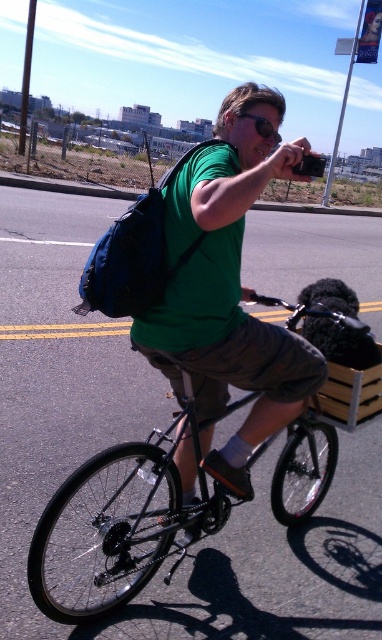
You are a photographer standing at the scene. You need to capture a photo where the green matte shirt at center and the black matte bicycle at center are both clearly visible. Based on their sizes in the image, which object should you focus on first to ensure both are in frame?

The green matte shirt at center is taller than the black matte bicycle at center, so you should focus on the green matte shirt at center first to ensure both are in frame since it is taller and might require more attention in the composition.

You are a photographer trying to capture the man and his bicycle. The green matte shirt at center and the black matte bicycle at center are both in your viewfinder. According to their positions, which object should you focus on first if you want to prioritize the subject closer to the left side of the frame?

The black matte bicycle at center should be focused on first because it is to the left of the green matte shirt at center, making it closer to the left side of the frame.